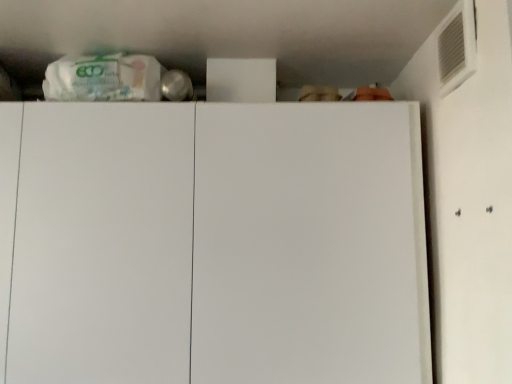
Question: From the image's perspective, is white plastic air conditioning at upper right located beneath white matte cabinet at center?

Choices:
 (A) no
 (B) yes

Answer: (A)

Question: From the image's perspective, is white plastic air conditioning at upper right on white matte cabinet at center?

Choices:
 (A) yes
 (B) no

Answer: (A)

Question: Is white plastic air conditioning at upper right far from white matte cabinet at center?

Choices:
 (A) yes
 (B) no

Answer: (B)

Question: From a real-world perspective, is white plastic air conditioning at upper right on white matte cabinet at center?

Choices:
 (A) no
 (B) yes

Answer: (B)

Question: Considering the relative positions of white plastic air conditioning at upper right and white matte cabinet at center in the image provided, is white plastic air conditioning at upper right to the left of white matte cabinet at center from the viewer's perspective?

Choices:
 (A) yes
 (B) no

Answer: (B)

Question: Is white plastic air conditioning at upper right with white matte cabinet at center?

Choices:
 (A) yes
 (B) no

Answer: (B)

Question: From the image's perspective, is white matte cabinet at center beneath white plastic air conditioning at upper right?

Choices:
 (A) yes
 (B) no

Answer: (A)

Question: Considering the relative sizes of white matte cabinet at center and white plastic air conditioning at upper right in the image provided, is white matte cabinet at center thinner than white plastic air conditioning at upper right?

Choices:
 (A) yes
 (B) no

Answer: (B)

Question: Is white matte cabinet at center oriented away from white plastic air conditioning at upper right?

Choices:
 (A) yes
 (B) no

Answer: (B)

Question: Does white matte cabinet at center have a greater height compared to white plastic air conditioning at upper right?

Choices:
 (A) yes
 (B) no

Answer: (A)

Question: Considering the relative positions of white matte cabinet at center and white plastic air conditioning at upper right in the image provided, is white matte cabinet at center behind white plastic air conditioning at upper right?

Choices:
 (A) no
 (B) yes

Answer: (B)

Question: From a real-world perspective, is white matte cabinet at center positioned under white plastic air conditioning at upper right based on gravity?

Choices:
 (A) no
 (B) yes

Answer: (B)

Question: Considering the positions of white plastic air conditioning at upper right and white matte cabinet at center in the image, is white plastic air conditioning at upper right wider or thinner than white matte cabinet at center?

Choices:
 (A) thin
 (B) wide

Answer: (A)